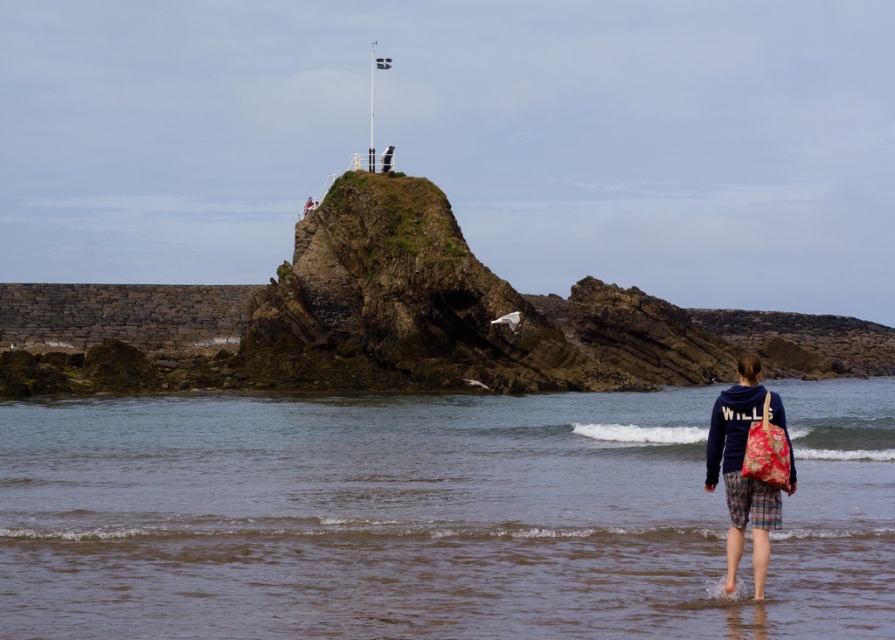
Does point (60, 509) lie behind point (740, 506)?

Yes.

Is brown sand at lower center closer to the viewer compared to dark blue fleece jacket at lower center?

That is True.

Locate an element on the screen. The width and height of the screenshot is (895, 640). brown sand at lower center is located at coordinates (432, 516).